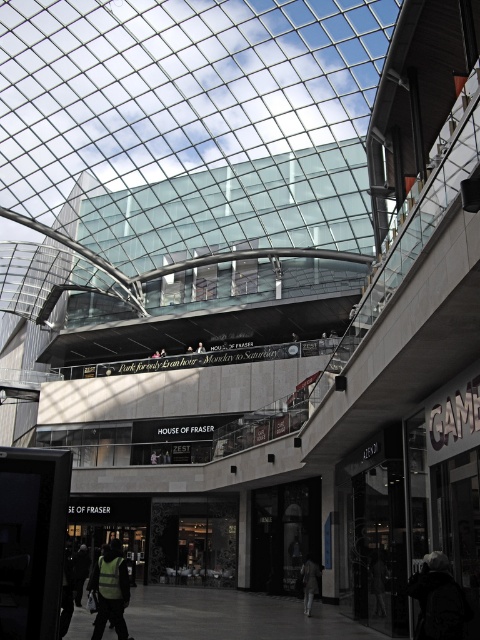
Question: Which point is closer to the camera?

Choices:
 (A) dark gray jacket at lower right
 (B) dark gray jacket at lower center
 (C) green fabric jacket at center

Answer: (A)

Question: Does reflective yellow vest at lower left appear on the right side of green fabric jacket at center?

Choices:
 (A) yes
 (B) no

Answer: (B)

Question: Is dark gray jacket at lower right above green fabric jacket at center?

Choices:
 (A) yes
 (B) no

Answer: (B)

Question: From the image, what is the correct spatial relationship of reflective yellow vest at lower left in relation to green fabric jacket at center?

Choices:
 (A) below
 (B) above

Answer: (A)

Question: Which object appears farthest from the camera in this image?

Choices:
 (A) dark gray jacket at lower center
 (B) dark gray jacket at lower right

Answer: (A)

Question: Among these objects, which one is nearest to the camera?

Choices:
 (A) dark gray jacket at lower right
 (B) reflective yellow vest at lower left

Answer: (A)